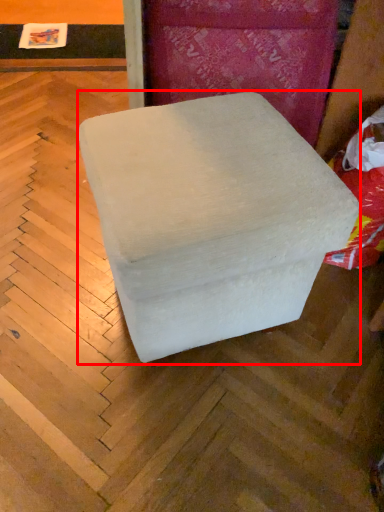
Question: Considering the relative positions of furniture (annotated by the red box) and bean bag chair in the image provided, where is furniture (annotated by the red box) located with respect to the staircase?

Choices:
 (A) left
 (B) right

Answer: (A)